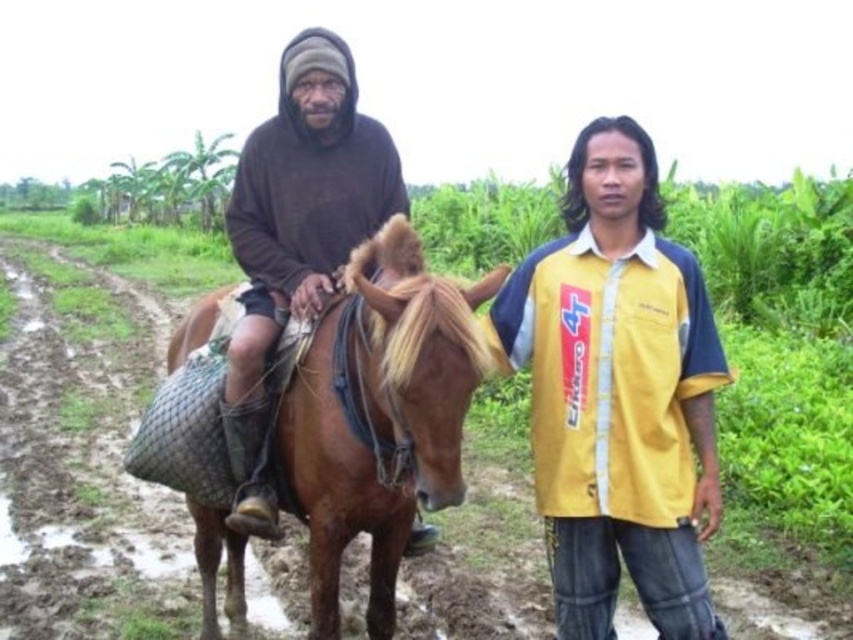
Question: Which point is closer to the camera taking this photo?

Choices:
 (A) (595, 477)
 (B) (318, 524)

Answer: (A)

Question: Is brown mud track at lower left to the left of brown leather horse at left from the viewer's perspective?

Choices:
 (A) yes
 (B) no

Answer: (A)

Question: Estimate the real-world distances between objects in this image. Which object is farther from the brown leather horse at left?

Choices:
 (A) yellow fabric shirt at center
 (B) brown mud track at lower left
 (C) brown matte clothing at left

Answer: (B)

Question: Which point is farther to the camera?

Choices:
 (A) brown leather horse at left
 (B) brown matte clothing at left
 (C) brown mud track at lower left

Answer: (C)

Question: In this image, where is brown mud track at lower left located relative to brown leather horse at left?

Choices:
 (A) right
 (B) left

Answer: (B)

Question: Can you confirm if brown mud track at lower left is positioned above brown matte clothing at left?

Choices:
 (A) no
 (B) yes

Answer: (A)